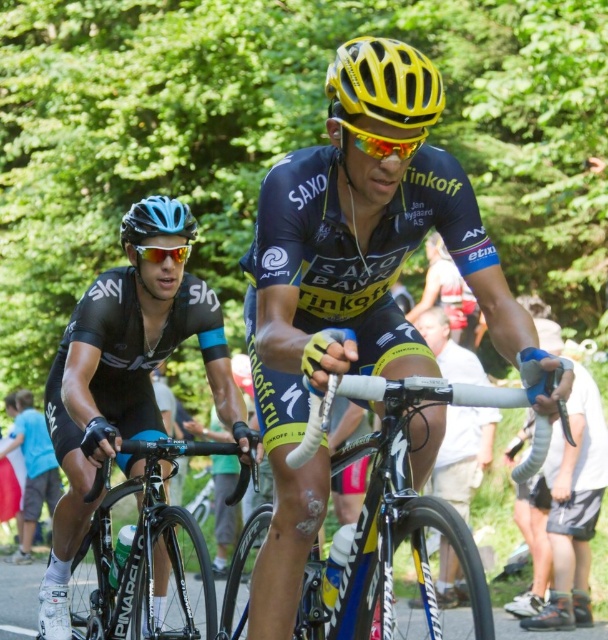
Question: Which point is closer to the camera taking this photo?

Choices:
 (A) (153, 214)
 (B) (170, 296)

Answer: (A)

Question: Can you confirm if black matte bicycle at center is positioned to the right of yellow matte bicycle helmet at upper center?

Choices:
 (A) yes
 (B) no

Answer: (B)

Question: Which object is closer to the camera taking this photo?

Choices:
 (A) matte blue bicycle helmet at left
 (B) black matte bicycle at center

Answer: (B)

Question: Which of the following is the closest to the observer?

Choices:
 (A) matte black jersey at center
 (B) black matte cycling jersey at left
 (C) yellow matte bicycle handlebar at center

Answer: (A)

Question: Is the position of yellow matte bicycle handlebar at center less distant than that of matte blue bicycle helmet at left?

Choices:
 (A) no
 (B) yes

Answer: (A)

Question: Where is matte black jersey at center located in relation to yellow matte bicycle handlebar at center in the image?

Choices:
 (A) right
 (B) left

Answer: (B)